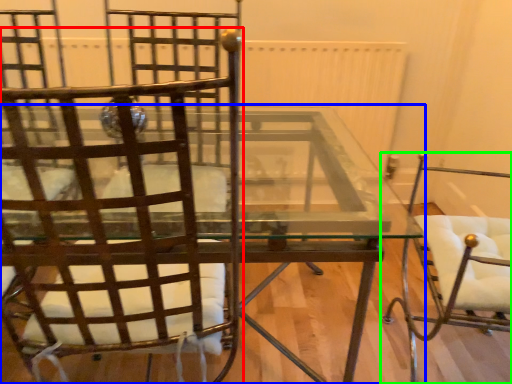
Question: Which is farther away from chair (highlighted by a red box)? table (highlighted by a blue box) or chair (highlighted by a green box)?

Choices:
 (A) table
 (B) chair

Answer: (B)